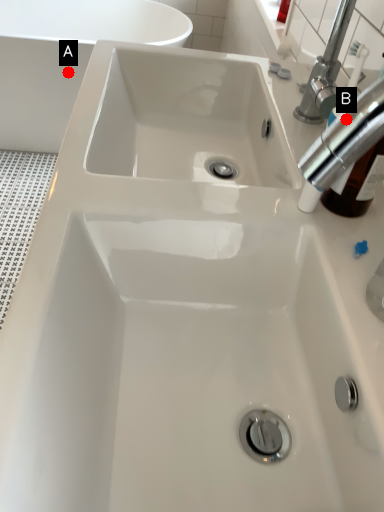
Question: Two points are circled on the image, labeled by A and B beside each circle. Which point appears farthest from the camera in this image?

Choices:
 (A) A is further
 (B) B is further

Answer: (A)